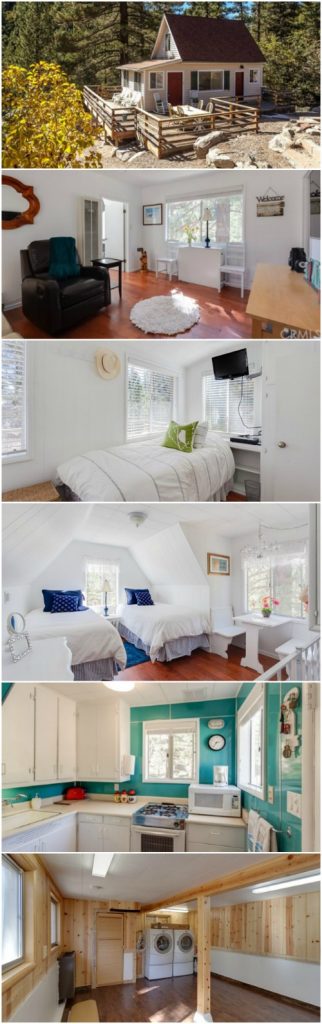
Identify the location of pillows third image. (141, 599), (131, 596), (70, 603), (78, 594).